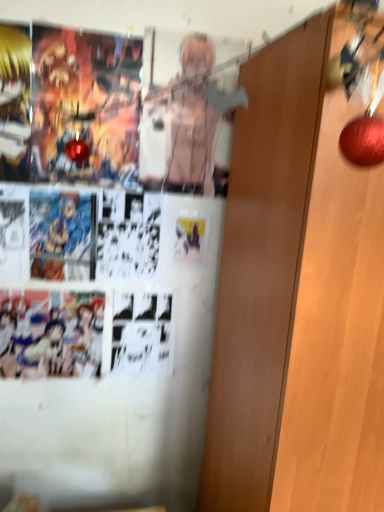
Question: Considering the positions of point (8, 92) and point (314, 54), is point (8, 92) closer or farther from the camera than point (314, 54)?

Choices:
 (A) closer
 (B) farther

Answer: (B)

Question: From their relative heights in the image, would you say golden hair anime character at left is taller or shorter than wooden door at right?

Choices:
 (A) tall
 (B) short

Answer: (B)

Question: Is golden hair anime character at left situated inside wooden door at right or outside?

Choices:
 (A) inside
 (B) outside

Answer: (B)

Question: Is wooden door at right wider or thinner than golden hair anime character at left?

Choices:
 (A) wide
 (B) thin

Answer: (A)

Question: Is point (264, 50) positioned closer to the camera than point (16, 153)?

Choices:
 (A) closer
 (B) farther

Answer: (A)

Question: Visually, is wooden door at right positioned to the left or to the right of golden hair anime character at left?

Choices:
 (A) left
 (B) right

Answer: (B)

Question: From a real-world perspective, is wooden door at right positioned above or below golden hair anime character at left?

Choices:
 (A) above
 (B) below

Answer: (B)